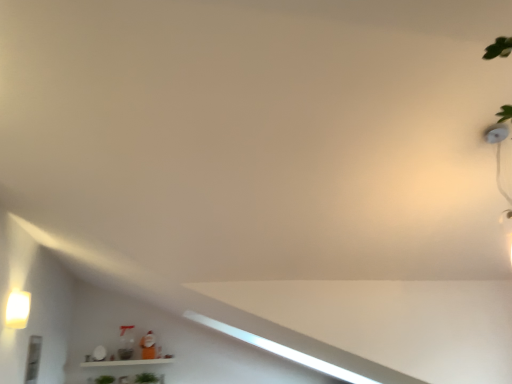
Question: Is point tap(138, 382) positioned closer to the camera than point tap(13, 322)?

Choices:
 (A) farther
 (B) closer

Answer: (A)

Question: From a real-world perspective, is green matte plant at lower center, arranged as the first plant when viewed from the right, positioned above or below matte white light fixture at left?

Choices:
 (A) below
 (B) above

Answer: (A)

Question: Which object is the closest to the matte white light fixture at left?

Choices:
 (A) green leafy plant at lower center, the 2th plant from the right
 (B) green matte plant at lower center, which is the second plant from left to right

Answer: (A)

Question: Estimate the real-world distances between objects in this image. Which object is closer to the green leafy plant at lower center, the 2th plant from the right?

Choices:
 (A) matte white light fixture at left
 (B) green matte plant at lower center, arranged as the first plant when viewed from the right

Answer: (B)